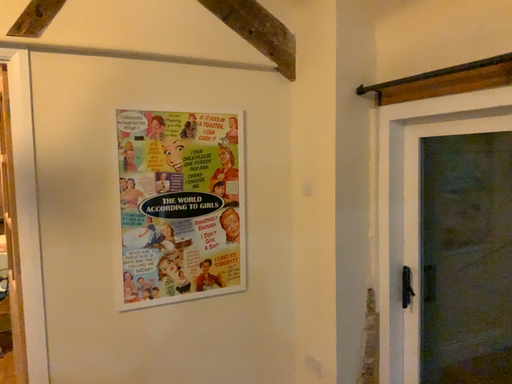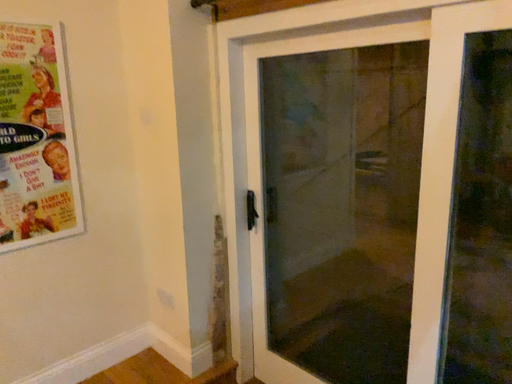
Question: Which way did the camera rotate in the video?

Choices:
 (A) rotated right
 (B) rotated left

Answer: (A)